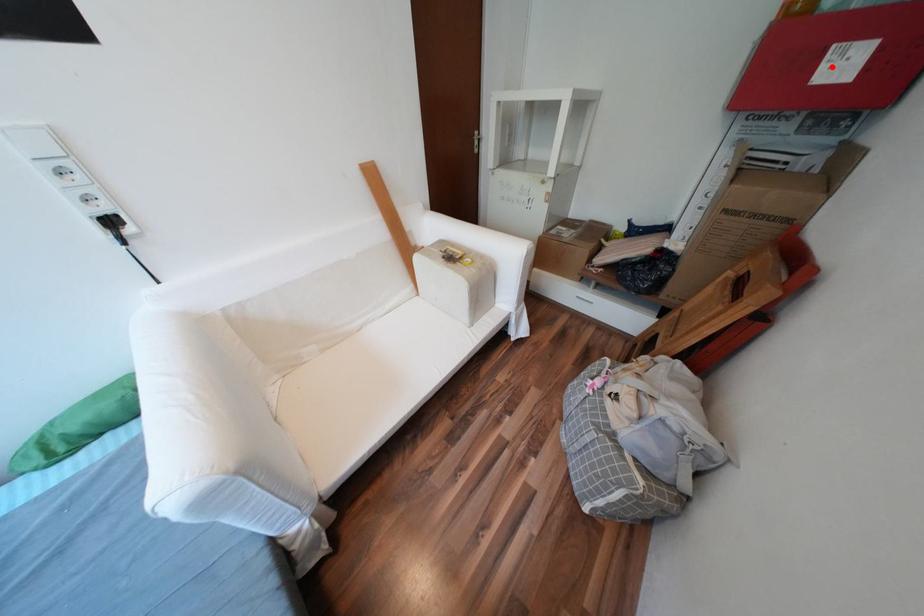
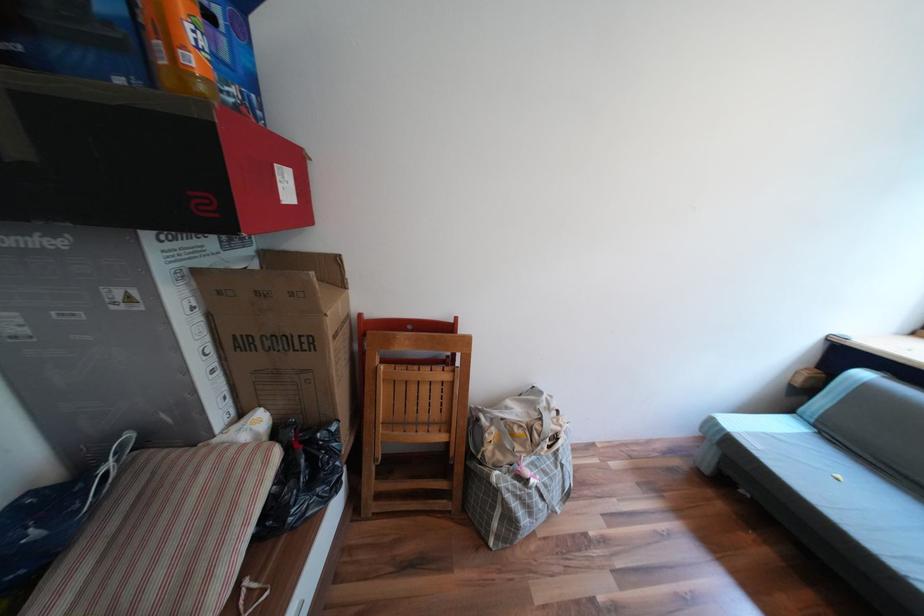
In the second image, find the point that corresponds to the highlighted location in the first image.

(289, 185)